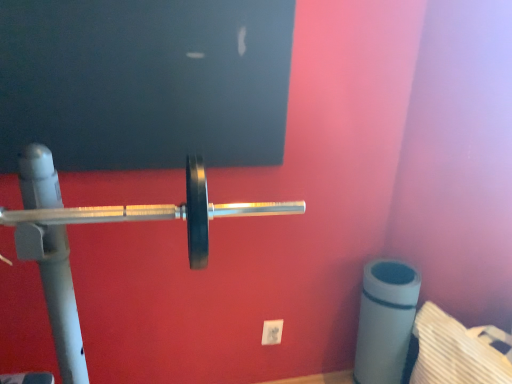
Describe the element at coordinates (115, 210) in the screenshot. I see `polished silver barbell at center` at that location.

This screenshot has height=384, width=512. Identify the location of polished silver barbell at center. (115, 210).

The height and width of the screenshot is (384, 512). Describe the element at coordinates (272, 332) in the screenshot. I see `white plastic power plug/socket at lower center` at that location.

What is the approximate width of white plastic power plug/socket at lower center?

white plastic power plug/socket at lower center is 0.94 inches in width.

This screenshot has height=384, width=512. Find the location of `white plastic power plug/socket at lower center`. white plastic power plug/socket at lower center is located at coordinates tap(272, 332).

You are a GUI agent. You are given a task and a screenshot of the screen. Output one action in this format:
    pyautogui.click(x=<x>, y=<y>)
    Task: Click on the polished silver barbell at center
    The image size is (512, 384).
    Given the screenshot: What is the action you would take?
    pyautogui.click(x=115, y=210)

Does white plastic power plug/socket at lower center appear on the right side of polished silver barbell at center?

Yes.

Relative to polished silver barbell at center, is white plastic power plug/socket at lower center in front or behind?

Clearly, white plastic power plug/socket at lower center is behind polished silver barbell at center.

Which is behind, point (271, 325) or point (265, 203)?

Positioned behind is point (271, 325).

From the image's perspective, which one is positioned lower, white plastic power plug/socket at lower center or polished silver barbell at center?

white plastic power plug/socket at lower center appears lower in the image.

From a real-world perspective, between white plastic power plug/socket at lower center and polished silver barbell at center, who is vertically higher?

polished silver barbell at center is physically above.

Considering the sizes of objects white plastic power plug/socket at lower center and polished silver barbell at center in the image provided, who is wider, white plastic power plug/socket at lower center or polished silver barbell at center?

Wider between the two is polished silver barbell at center.

Can you confirm if white plastic power plug/socket at lower center is taller than polished silver barbell at center?

In fact, white plastic power plug/socket at lower center may be shorter than polished silver barbell at center.

In terms of size, does white plastic power plug/socket at lower center appear bigger or smaller than polished silver barbell at center?

Considering their sizes, white plastic power plug/socket at lower center takes up less space than polished silver barbell at center.

Is white plastic power plug/socket at lower center not within polished silver barbell at center?

Absolutely, white plastic power plug/socket at lower center is external to polished silver barbell at center.

Are white plastic power plug/socket at lower center and polished silver barbell at center making contact?

white plastic power plug/socket at lower center and polished silver barbell at center are clearly separated.

Is white plastic power plug/socket at lower center facing towards polished silver barbell at center?

No.

How many degrees apart are the facing directions of white plastic power plug/socket at lower center and polished silver barbell at center?

They differ by 3.26 degrees in their facing directions.

How far apart are white plastic power plug/socket at lower center and polished silver barbell at center?

1.01 meters.

The height and width of the screenshot is (384, 512). Identify the location of barbell above the white plastic power plug/socket at lower center (from a real-world perspective). (115, 210).

Considering the relative positions of polished silver barbell at center and white plastic power plug/socket at lower center in the image provided, is polished silver barbell at center to the right of white plastic power plug/socket at lower center from the viewer's perspective?

No.

Between polished silver barbell at center and white plastic power plug/socket at lower center, which one is positioned in front?

polished silver barbell at center is closer to the camera.

Considering the points (254, 215) and (277, 337), which point is in front, point (254, 215) or point (277, 337)?

The point (254, 215) is in front.

From the image's perspective, which is above, polished silver barbell at center or white plastic power plug/socket at lower center?

A: From the image's view, polished silver barbell at center is above.

From a real-world perspective, relative to white plastic power plug/socket at lower center, is polished silver barbell at center vertically above or below?

Clearly, from a real-world perspective, polished silver barbell at center is above white plastic power plug/socket at lower center.

Looking at their sizes, would you say polished silver barbell at center is wider or thinner than white plastic power plug/socket at lower center?

polished silver barbell at center is wider than white plastic power plug/socket at lower center.

Looking at this image, is polished silver barbell at center taller or shorter than white plastic power plug/socket at lower center?

polished silver barbell at center is taller than white plastic power plug/socket at lower center.

Between polished silver barbell at center and white plastic power plug/socket at lower center, which one has larger size?

polished silver barbell at center.

Would you say polished silver barbell at center is inside or outside white plastic power plug/socket at lower center?

polished silver barbell at center is not inside white plastic power plug/socket at lower center, it's outside.

Is polished silver barbell at center with white plastic power plug/socket at lower center?

polished silver barbell at center is not next to white plastic power plug/socket at lower center, and they're not touching.

Is polished silver barbell at center aimed at white plastic power plug/socket at lower center?

No, polished silver barbell at center is not turned towards white plastic power plug/socket at lower center.

At what (x,y) coordinates should I click in order to perform the action: click on barbell that appears on the left of white plastic power plug/socket at lower center. Please return your answer as a coordinate pair (x, y). Looking at the image, I should click on (115, 210).

Where is `power plugs and sockets below the polished silver barbell at center (from the image's perspective)`? This screenshot has height=384, width=512. power plugs and sockets below the polished silver barbell at center (from the image's perspective) is located at coordinates (272, 332).

Find the location of a particular element. Image resolution: width=512 pixels, height=384 pixels. barbell in front of the white plastic power plug/socket at lower center is located at coordinates (115, 210).